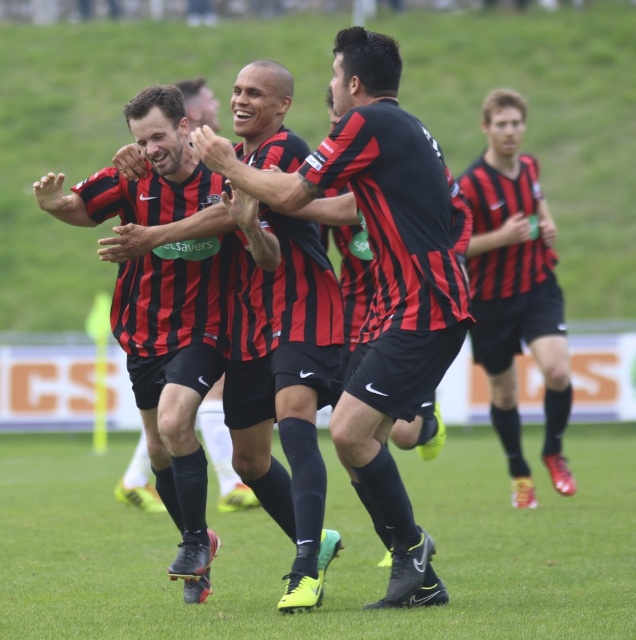
Describe the element at coordinates (335, 560) in the screenshot. I see `green grass at center` at that location.

Who is more forward, (x=354, y=552) or (x=174, y=180)?

Point (x=174, y=180)

Does point (577, 573) come behind point (211, 317)?

Yes, point (577, 573) is farther from viewer.

Find the location of a particular element. green grass at center is located at coordinates (335, 560).

Is point (151, 292) positioned behind point (501, 292)?

No, (151, 292) is in front of (501, 292).

Which is behind, point (172, 259) or point (563, 385)?

The point (563, 385) is behind.

The image size is (636, 640). What do you see at coordinates (176, 378) in the screenshot?
I see `matte black jersey at center` at bounding box center [176, 378].

The image size is (636, 640). I want to click on matte black jersey at center, so click(176, 378).

Does green grass at center appear under matte black shorts at right?

Indeed, green grass at center is positioned under matte black shorts at right.

Is point (80, 532) in front of point (509, 273)?

Yes, it is in front of point (509, 273).

Find the location of `green grass at center`. green grass at center is located at coordinates (335, 560).